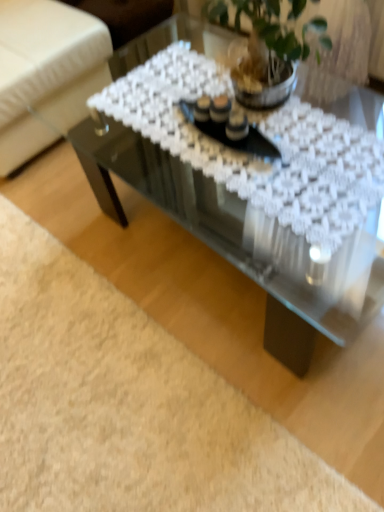
Where is `free location to the right of clear glass plate at center`? The image size is (384, 512). free location to the right of clear glass plate at center is located at coordinates (299, 131).